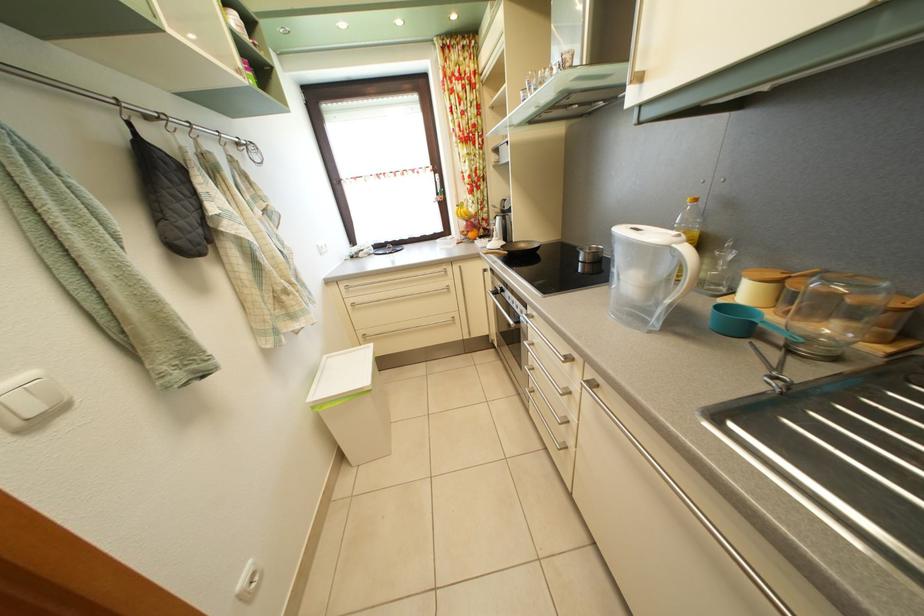
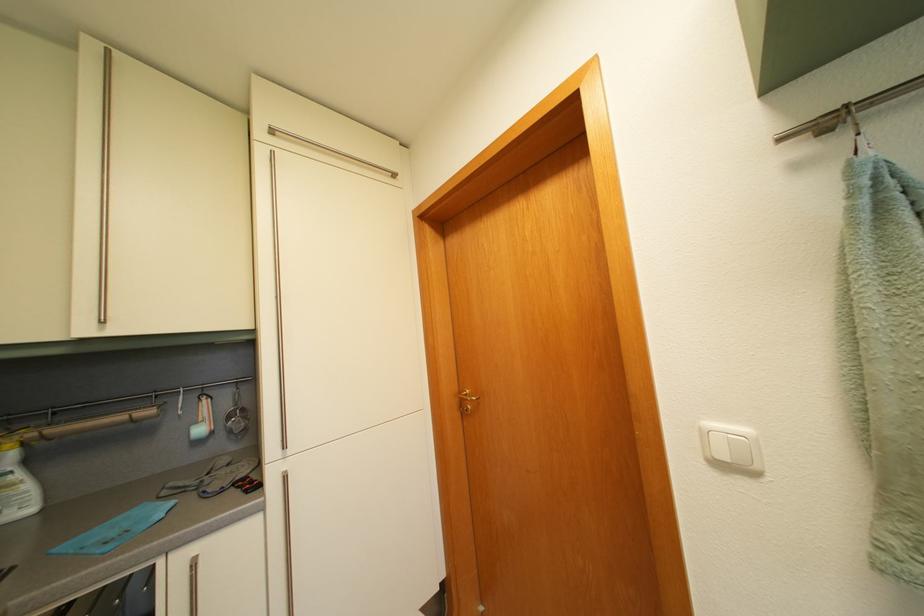
Where in the second image is the point corresponding to pixel 38 382 from the first image?

(755, 438)